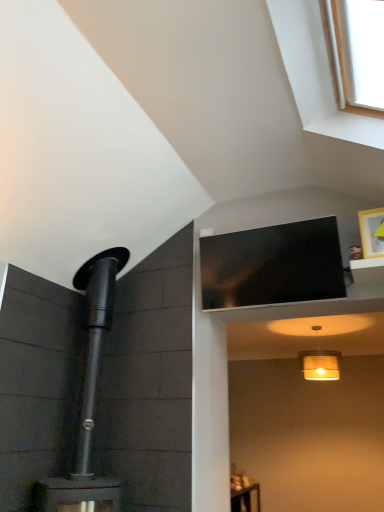
Question: Is white wood window at upper right at the back of matte white lampshade at lower center?

Choices:
 (A) yes
 (B) no

Answer: (B)

Question: Is white wood window at upper right completely or partially inside matte white lampshade at lower center?

Choices:
 (A) no
 (B) yes

Answer: (A)

Question: From the image's perspective, is matte white lampshade at lower center below white wood window at upper right?

Choices:
 (A) no
 (B) yes

Answer: (B)

Question: Does matte white lampshade at lower center have a greater height compared to white wood window at upper right?

Choices:
 (A) yes
 (B) no

Answer: (B)

Question: From a real-world perspective, is matte white lampshade at lower center on top of white wood window at upper right?

Choices:
 (A) yes
 (B) no

Answer: (B)

Question: Does matte white lampshade at lower center have a greater width compared to white wood window at upper right?

Choices:
 (A) no
 (B) yes

Answer: (A)

Question: Can you confirm if black glossy tv at upper center is thinner than white wood window at upper right?

Choices:
 (A) no
 (B) yes

Answer: (B)

Question: Is black glossy tv at upper center looking in the opposite direction of white wood window at upper right?

Choices:
 (A) yes
 (B) no

Answer: (B)

Question: From a real-world perspective, does black glossy tv at upper center stand above white wood window at upper right?

Choices:
 (A) no
 (B) yes

Answer: (A)

Question: Does black glossy tv at upper center have a greater width compared to white wood window at upper right?

Choices:
 (A) yes
 (B) no

Answer: (B)

Question: Is black glossy tv at upper center in front of white wood window at upper right?

Choices:
 (A) no
 (B) yes

Answer: (A)

Question: Is black glossy tv at upper center facing towards white wood window at upper right?

Choices:
 (A) no
 (B) yes

Answer: (B)

Question: From the image's perspective, does white wood window at upper right appear lower than black glossy tv at upper center?

Choices:
 (A) yes
 (B) no

Answer: (B)